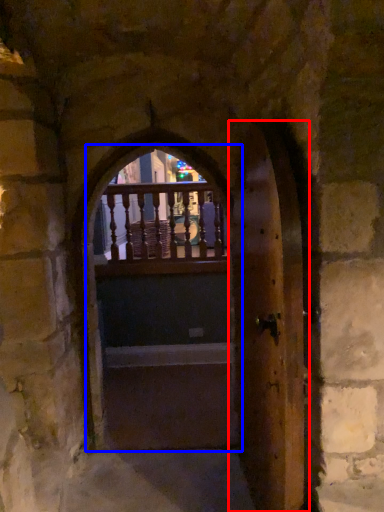
Question: Which of the following is the closest to the observer, door (highlighted by a red box) or door (highlighted by a blue box)?

Choices:
 (A) door
 (B) door

Answer: (A)